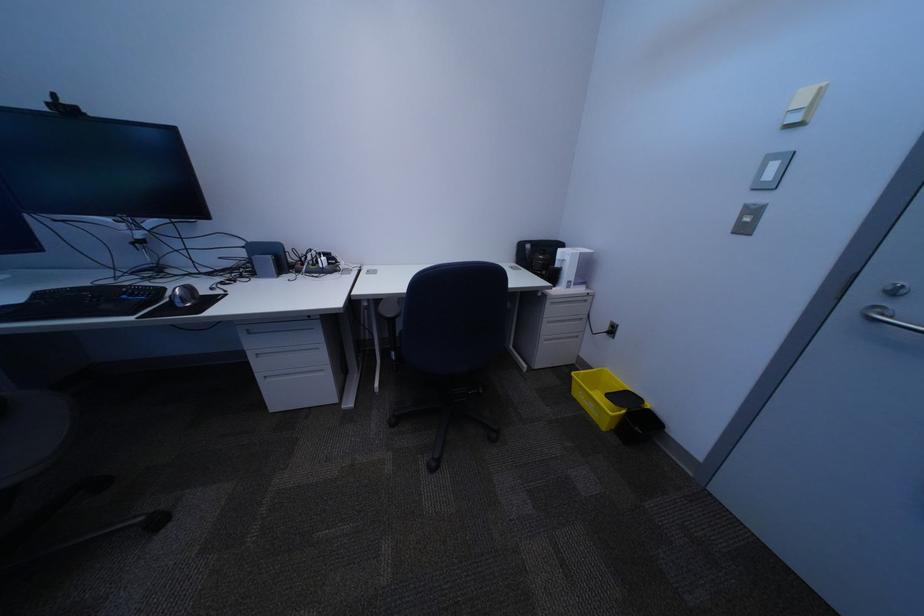
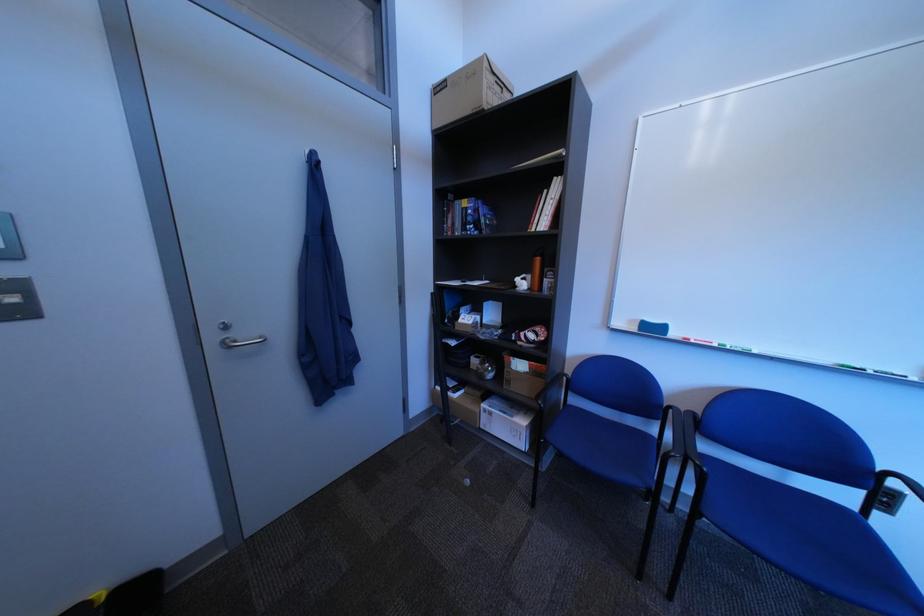
Where in the second image is the point corresponding to the point at 877,299 from the first image?

(226, 339)